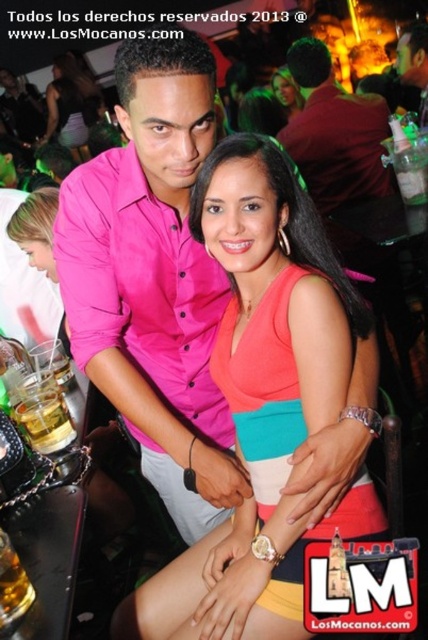
Is pink fabric dress at center to the right of dark red shirt at upper center from the viewer's perspective?

In fact, pink fabric dress at center is to the left of dark red shirt at upper center.

What do you see at coordinates (258, 396) in the screenshot?
I see `pink fabric dress at center` at bounding box center [258, 396].

You are a GUI agent. You are given a task and a screenshot of the screen. Output one action in this format:
    pyautogui.click(x=<x>, y=<y>)
    Task: Click on the pink fabric dress at center
    The width and height of the screenshot is (428, 640).
    Given the screenshot: What is the action you would take?
    pyautogui.click(x=258, y=396)

In order to click on pink fabric dress at center in this screenshot , I will do `click(258, 396)`.

Does point (240, 141) come farther from viewer compared to point (142, 435)?

No, (240, 141) is closer to viewer.

How much distance is there between pink fabric dress at center and pink matte shirt at center?

A distance of 8.34 inches exists between pink fabric dress at center and pink matte shirt at center.

The image size is (428, 640). What do you see at coordinates (258, 396) in the screenshot?
I see `pink fabric dress at center` at bounding box center [258, 396].

Where is `pink fabric dress at center`? The height and width of the screenshot is (640, 428). pink fabric dress at center is located at coordinates (258, 396).

Is pink matte shirt at center shorter than matte coral dress at center?

No, pink matte shirt at center is not shorter than matte coral dress at center.

Looking at this image, does pink matte shirt at center have a lesser width compared to matte coral dress at center?

No, pink matte shirt at center is not thinner than matte coral dress at center.

Find the location of a particular element. pink matte shirt at center is located at coordinates (154, 280).

You are a GUI agent. You are given a task and a screenshot of the screen. Output one action in this format:
    pyautogui.click(x=<x>, y=<y>)
    Task: Click on the pink matte shirt at center
    
    Given the screenshot: What is the action you would take?
    pyautogui.click(x=154, y=280)